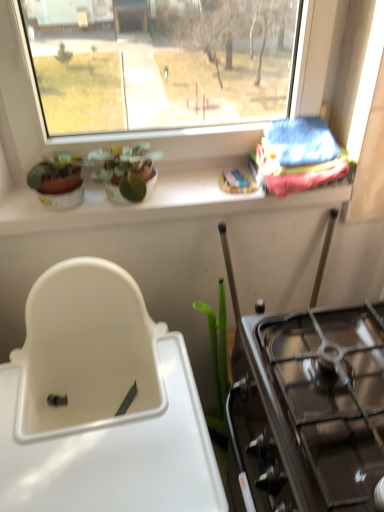
Question: Looking at their shapes, would you say blue fabric at upper right is wider or thinner than white ceramic window sill at upper center?

Choices:
 (A) thin
 (B) wide

Answer: (B)

Question: Visually, is blue fabric at upper right positioned to the left or to the right of white ceramic window sill at upper center?

Choices:
 (A) right
 (B) left

Answer: (A)

Question: Estimate the real-world distances between objects in this image. Which object is closer to the matte ceramic plant at upper center?

Choices:
 (A) black glass gas stove at right
 (B) blue fabric at upper right
 (C) white ceramic window sill at upper center
 (D) white plastic sink at lower left

Answer: (C)

Question: Based on their relative distances, which object is nearer to the white plastic sink at lower left?

Choices:
 (A) blue fabric at upper right
 (B) black glass gas stove at right
 (C) matte ceramic plant at upper center
 (D) white ceramic window sill at upper center

Answer: (B)